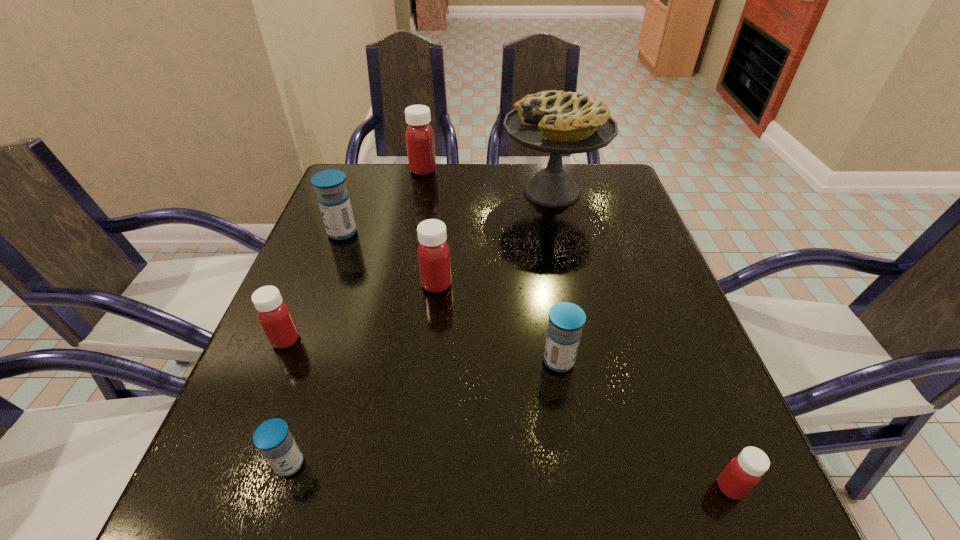
You are a GUI agent. You are given a task and a screenshot of the screen. Output one action in this format:
    pyautogui.click(x=<x>, y=<y>)
    Task: Click on the object situated at the near right corner
    
    Given the screenshot: What is the action you would take?
    pyautogui.click(x=744, y=472)

The height and width of the screenshot is (540, 960). In order to click on free point at the far edge in this screenshot , I will do `click(522, 172)`.

Image resolution: width=960 pixels, height=540 pixels. Identify the location of free space at the near edge of the desktop. (639, 501).

You are a GUI agent. You are given a task and a screenshot of the screen. Output one action in this format:
    pyautogui.click(x=<x>, y=<y>)
    Task: Click on the free space at the left edge
    
    Given the screenshot: What is the action you would take?
    pyautogui.click(x=293, y=282)

What are the coordinates of `free space at the right edge of the desktop` in the screenshot? It's located at (613, 259).

You are a GUI agent. You are given a task and a screenshot of the screen. Output one action in this format:
    pyautogui.click(x=<x>, y=<y>)
    Task: Click on the vacant region at the far left corner
    This screenshot has height=540, width=960.
    Given the screenshot: What is the action you would take?
    pyautogui.click(x=394, y=175)

The height and width of the screenshot is (540, 960). In order to click on free space at the far right corner in this screenshot , I will do `click(616, 165)`.

In order to click on vacant area that lies between the tallest object and the farthest medicine in this screenshot , I will do `click(488, 181)`.

Identify the location of blank region between the rightmost object and the second nearest red medicine. (508, 414).

This screenshot has width=960, height=540. I want to click on free space that is in between the fourth object from left to right and the third farthest object, so click(383, 201).